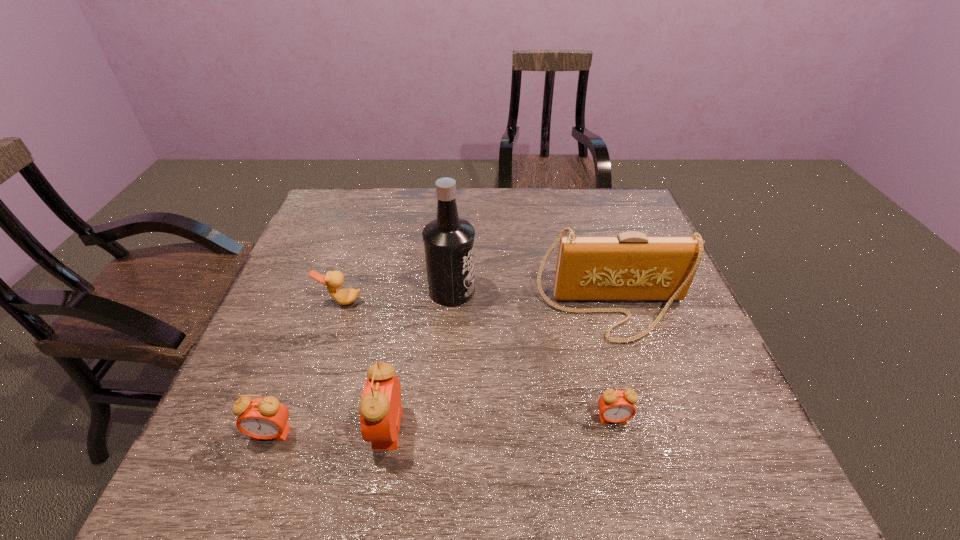
Where is `unoccupied area between the leftmost alarm clock and the shortest alarm clock`? unoccupied area between the leftmost alarm clock and the shortest alarm clock is located at coordinates (443, 426).

You are a GUI agent. You are given a task and a screenshot of the screen. Output one action in this format:
    pyautogui.click(x=<x>, y=<y>)
    Task: Click on the vacant area that lies between the shortest alarm clock and the duck
    
    Given the screenshot: What is the action you would take?
    pyautogui.click(x=477, y=360)

Locate an element on the screen. The image size is (960, 540). free spot between the leftmost alarm clock and the liquor is located at coordinates (362, 362).

Identify which object is the fourth nearest to the third object from left to right. Please provide its 2D coordinates. Your answer should be formatted as a tuple, i.e. [(x, y)], where the tuple contains the x and y coordinates of a point satisfying the conditions above.

[(631, 266)]

The height and width of the screenshot is (540, 960). In order to click on the second closest object to the fourth object from right to left in this screenshot , I will do `click(449, 246)`.

Where is `alarm clock that stands as the third closest to the third object from right to left`? alarm clock that stands as the third closest to the third object from right to left is located at coordinates (266, 418).

Locate an element on the screen. alarm clock that can be found as the second closest to the tallest alarm clock is located at coordinates (615, 406).

At what (x,y) coordinates should I click in order to perform the action: click on free space that satisfies the following two spatial constraints: 1. on the decorative side of the handbag; 2. on the face of the second alarm clock from right to left. Please return your answer as a coordinate pair (x, y). The image size is (960, 540). Looking at the image, I should click on (648, 428).

Find the location of a particular element. This screenshot has width=960, height=540. free space that satisfies the following two spatial constraints: 1. on the face of the tallest alarm clock; 2. on the face of the leftmost alarm clock is located at coordinates (387, 433).

Locate an element on the screen. The width and height of the screenshot is (960, 540). vacant area in the image that satisfies the following two spatial constraints: 1. on the face of the fourth object from right to left; 2. on the face of the third shortest object is located at coordinates (387, 433).